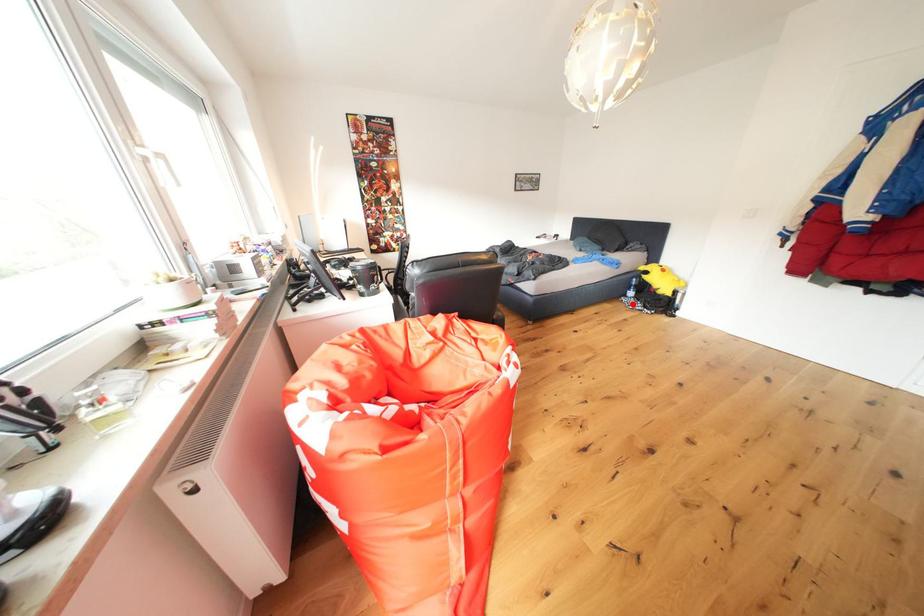
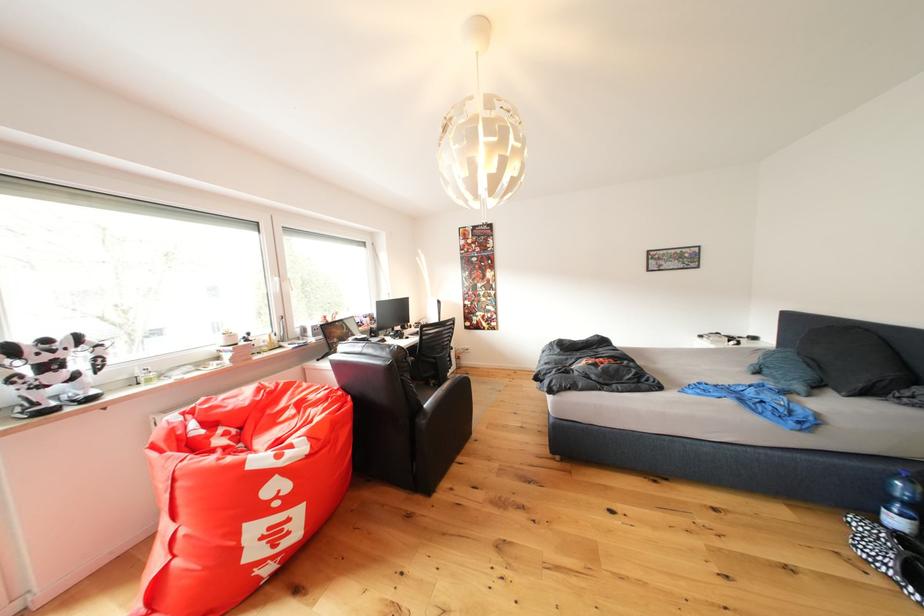
Question: A red point is marked in image1. In image2, is the corresponding 3D point closer to the camera or farther? Reply with the corresponding letter.

Choices:
 (A) The corresponding 3D point is closer.
 (B) The corresponding 3D point is farther.

Answer: (B)